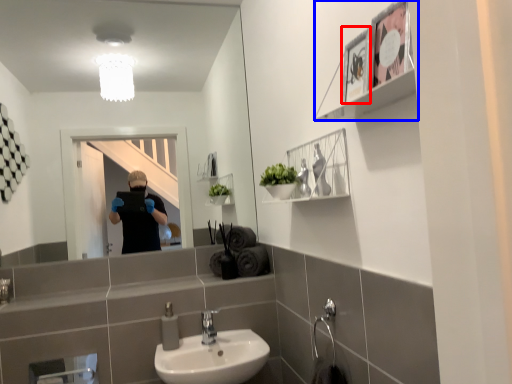
Question: Which object appears farthest to the camera in this image, picture frame (highlighted by a red box) or cabinet (highlighted by a blue box)?

Choices:
 (A) picture frame
 (B) cabinet

Answer: (A)